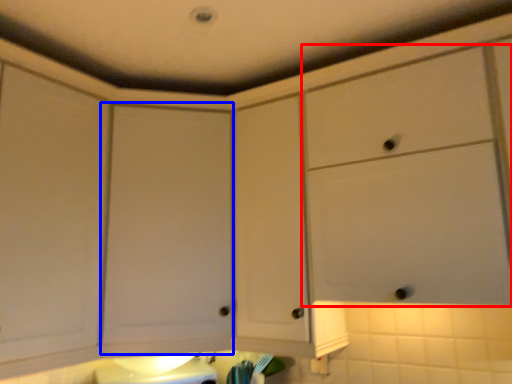
Question: Which point is closer to the camera, cabinetry (highlighted by a red box) or cabinetry (highlighted by a blue box)?

Choices:
 (A) cabinetry
 (B) cabinetry

Answer: (A)